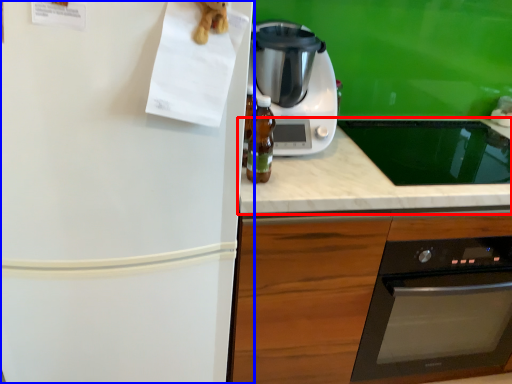
Question: Which point is closer to the camera, countertop (highlighted by a red box) or refrigerator (highlighted by a blue box)?

Choices:
 (A) countertop
 (B) refrigerator

Answer: (B)